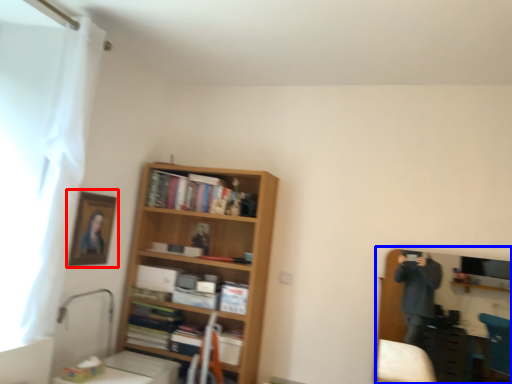
Question: Among these objects, which one is nearest to the camera, picture frame (highlighted by a red box) or entertainment center (highlighted by a blue box)?

Choices:
 (A) picture frame
 (B) entertainment center

Answer: (B)